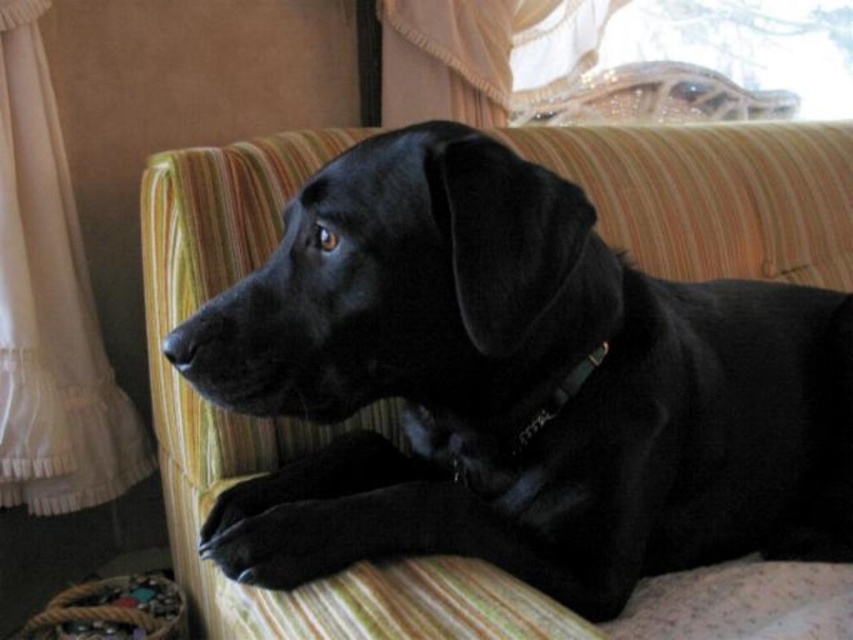
Question: Which point is farther to the camera?

Choices:
 (A) (45, 234)
 (B) (229, 371)

Answer: (A)

Question: From the image, what is the correct spatial relationship of shiny black dog at center in relation to white sheer curtain at left?

Choices:
 (A) above
 (B) below

Answer: (B)

Question: Does shiny black dog at center come behind white sheer curtain at left?

Choices:
 (A) yes
 (B) no

Answer: (B)

Question: Which point is farther from the camera taking this photo?

Choices:
 (A) (259, 285)
 (B) (28, 164)

Answer: (B)

Question: From the image, what is the correct spatial relationship of shiny black dog at center in relation to white sheer curtain at left?

Choices:
 (A) above
 (B) below

Answer: (B)